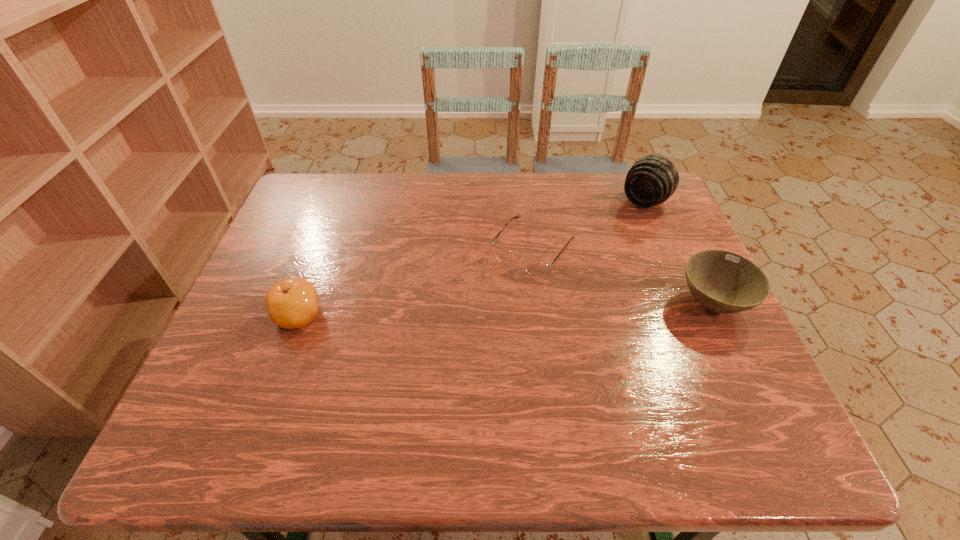
The width and height of the screenshot is (960, 540). I want to click on vacant space at the near edge of the desktop, so click(572, 378).

Locate an element on the screen. The width and height of the screenshot is (960, 540). vacant space at the right edge is located at coordinates (680, 312).

This screenshot has height=540, width=960. I want to click on vacant space at the far left corner of the desktop, so click(307, 190).

The width and height of the screenshot is (960, 540). Identify the location of vacant region at the near left corner of the desktop. (267, 379).

The height and width of the screenshot is (540, 960). I want to click on vacant region at the far right corner of the desktop, so click(675, 214).

Identify the location of vacant position at the near right corner of the desktop. The image size is (960, 540). (704, 368).

Find the location of a particular element. vacant area that lies between the telephoto lens and the clementine is located at coordinates (471, 259).

The width and height of the screenshot is (960, 540). In order to click on free spot between the bowl and the leftmost object in this screenshot , I will do `click(505, 309)`.

In order to click on free space between the bowl and the leftmost object in this screenshot , I will do `click(505, 309)`.

This screenshot has width=960, height=540. I want to click on free space that is in between the spectacles and the farthest object, so click(588, 226).